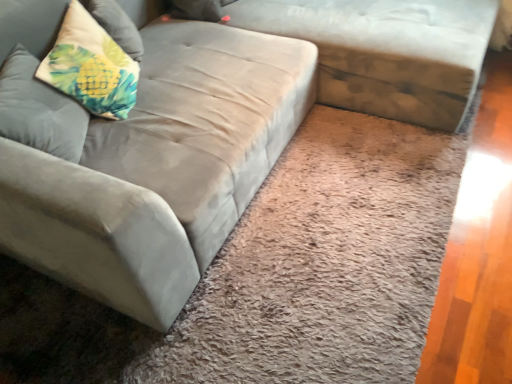
Question: Is suede gray couch at center at the back of textured beige pillow at upper left, placed as the 2th pillow when sorted from bottom to top?

Choices:
 (A) no
 (B) yes

Answer: (A)

Question: Is textured beige pillow at upper left, placed as the 2th pillow when sorted from bottom to top, bigger than suede gray couch at center?

Choices:
 (A) no
 (B) yes

Answer: (A)

Question: Can you confirm if textured beige pillow at upper left, the first pillow viewed from the top, is smaller than suede gray couch at center?

Choices:
 (A) yes
 (B) no

Answer: (A)

Question: Does textured beige pillow at upper left, placed as the 2th pillow when sorted from bottom to top, touch suede gray couch at center?

Choices:
 (A) yes
 (B) no

Answer: (B)

Question: Does textured beige pillow at upper left, the first pillow viewed from the top, have a lesser width compared to suede gray couch at center?

Choices:
 (A) no
 (B) yes

Answer: (B)

Question: From the image's perspective, is suede gray couch at center located above or below textured beige pillow at upper left, the first pillow viewed from the top?

Choices:
 (A) above
 (B) below

Answer: (A)

Question: Looking at the image, does suede gray couch at center seem bigger or smaller compared to textured beige pillow at upper left, the first pillow viewed from the top?

Choices:
 (A) small
 (B) big

Answer: (B)

Question: From their relative heights in the image, would you say suede gray couch at center is taller or shorter than textured beige pillow at upper left, the first pillow viewed from the top?

Choices:
 (A) short
 (B) tall

Answer: (B)

Question: Do you think suede gray couch at center is within textured beige pillow at upper left, the first pillow viewed from the top, or outside of it?

Choices:
 (A) inside
 (B) outside

Answer: (B)

Question: In the image, is suede gray couch at center on the left side or the right side of fluffy fabric pillow at upper left, the 1th pillow ordered from the bottom?

Choices:
 (A) left
 (B) right

Answer: (B)

Question: Is suede gray couch at center spatially inside fluffy fabric pillow at upper left, the 1th pillow ordered from the bottom, or outside of it?

Choices:
 (A) outside
 (B) inside

Answer: (A)

Question: Looking at the image, does suede gray couch at center seem bigger or smaller compared to fluffy fabric pillow at upper left, which is the second pillow from top to bottom?

Choices:
 (A) small
 (B) big

Answer: (B)

Question: From a real-world perspective, is suede gray couch at center positioned above or below fluffy fabric pillow at upper left, which is the second pillow from top to bottom?

Choices:
 (A) above
 (B) below

Answer: (B)

Question: From a real-world perspective, is textured beige pillow at upper left, the first pillow viewed from the top, physically located above or below suede gray couch at center?

Choices:
 (A) above
 (B) below

Answer: (A)

Question: Does point (58, 46) appear closer or farther from the camera than point (313, 21)?

Choices:
 (A) closer
 (B) farther

Answer: (A)